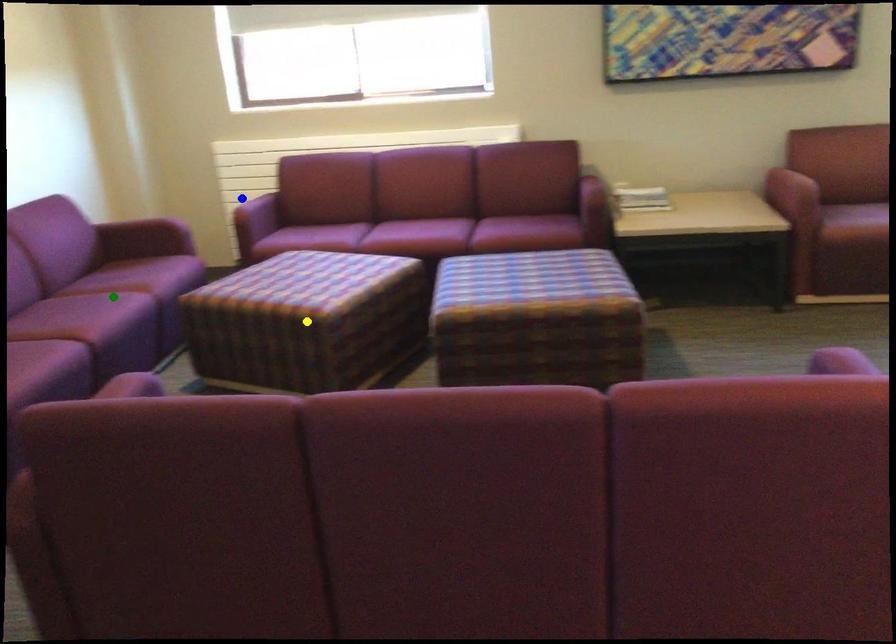
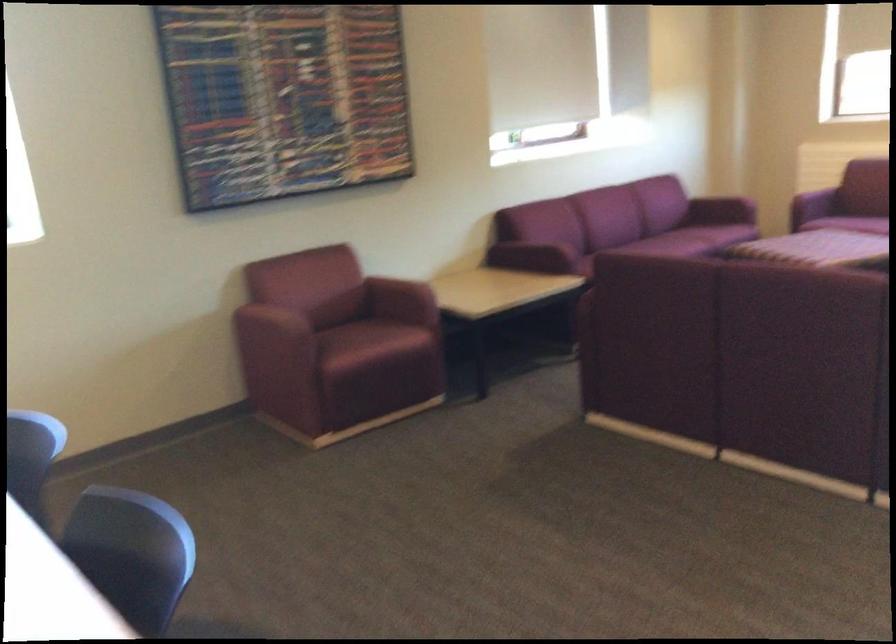
I am providing you with two images of the same scene from different viewpoints. Three points are marked in image1. Which point corresponds to a part or object that is occluded in image2?In image1, three points are marked. Which of them correspond to a part or object that is occluded in image2?Among the three points shown in image1, which one corresponds to a part or object that is no longer visible due to occlusion in image2?

blue point, yellow point cannot be seen in image2.